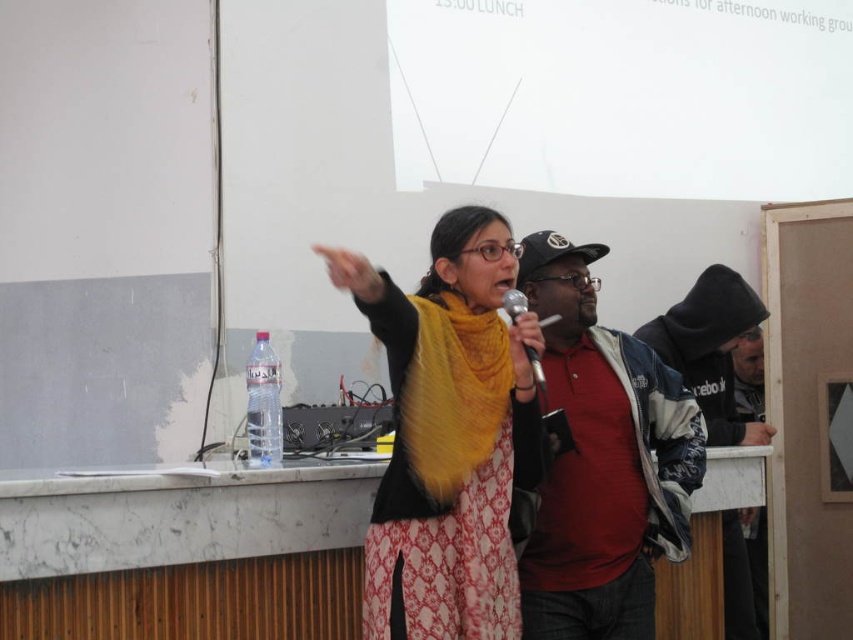
Question: Can you confirm if matte black jacket at center is positioned below dark blue hoodie at right?

Choices:
 (A) no
 (B) yes

Answer: (B)

Question: Can you confirm if matte black jacket at center is positioned to the right of dark blue hoodie at right?

Choices:
 (A) yes
 (B) no

Answer: (B)

Question: Is yellow wool scarf at center smaller than dark blue hoodie at right?

Choices:
 (A) no
 (B) yes

Answer: (A)

Question: Considering the real-world distances, which object is closest to the metallic silver microphone at center?

Choices:
 (A) yellow wool scarf at center
 (B) dark blue hoodie at right

Answer: (A)

Question: Which is nearer to the metallic silver microphone at center?

Choices:
 (A) matte black jacket at center
 (B) yellow wool scarf at center
 (C) dark blue hoodie at right

Answer: (B)

Question: Which of the following is the closest to the observer?

Choices:
 (A) yellow wool scarf at center
 (B) dark blue hoodie at right
 (C) matte black jacket at center

Answer: (A)